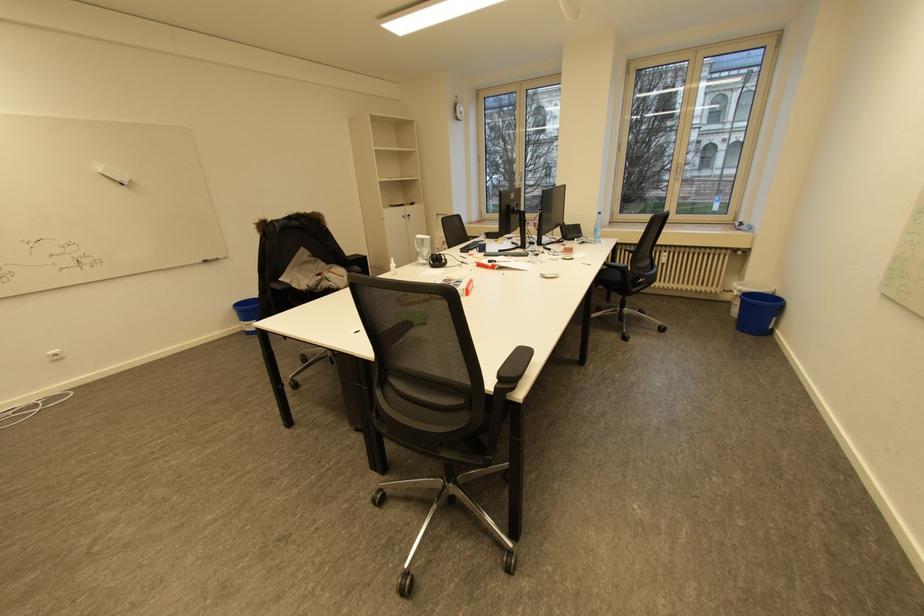
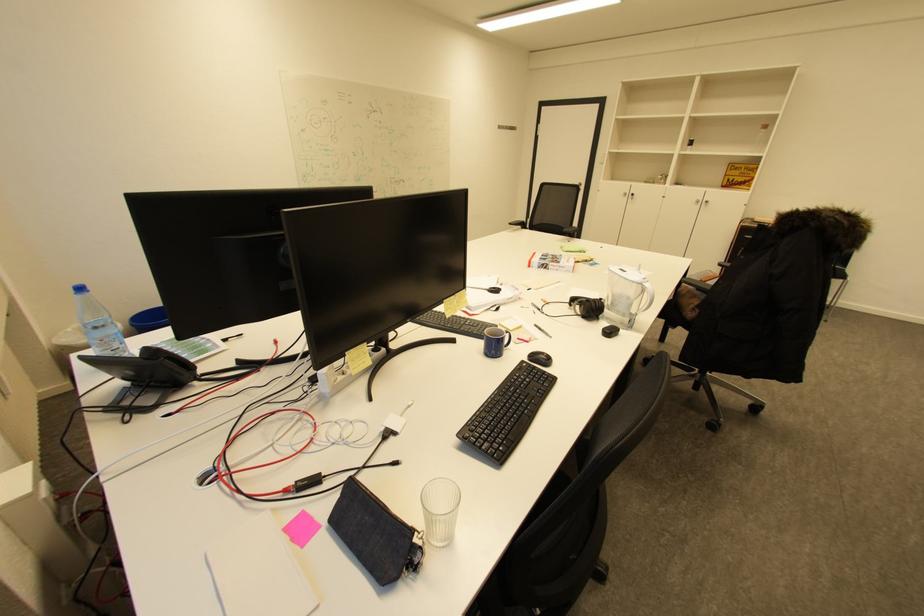
Where in the second image is the point corresponding to (x=503, y=262) from the first image?

(492, 292)